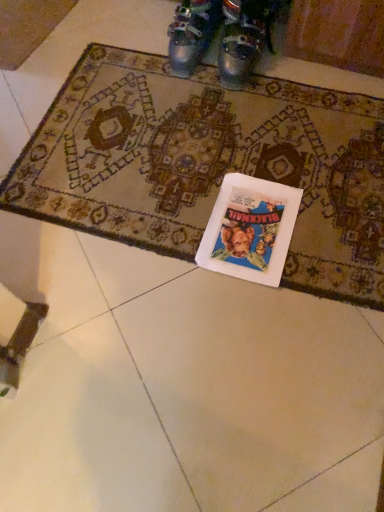
At what (x,y) coordinates should I click in order to perform the action: click on vacant area that lies between metallic silver boots at upper center, the second footwear when ordered from right to left, and carpeted mat at center. Please return your answer as a coordinate pair (x, y). The height and width of the screenshot is (512, 384). Looking at the image, I should click on (253, 61).